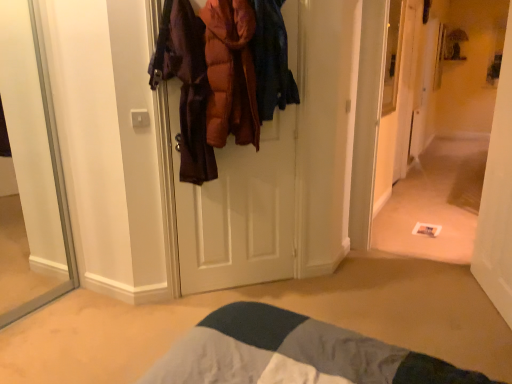
Question: Is white carpet at center at the back of white glossy door at center?

Choices:
 (A) no
 (B) yes

Answer: (A)

Question: Is white carpet at center surrounded by white glossy door at center?

Choices:
 (A) yes
 (B) no

Answer: (B)

Question: From the image's perspective, does white glossy door at center appear lower than white carpet at center?

Choices:
 (A) no
 (B) yes

Answer: (B)

Question: Does white glossy door at center have a greater height compared to white carpet at center?

Choices:
 (A) yes
 (B) no

Answer: (B)

Question: Is white glossy door at center to the right of white carpet at center from the viewer's perspective?

Choices:
 (A) yes
 (B) no

Answer: (A)

Question: Considering the relative sizes of white glossy door at center and white carpet at center in the image provided, is white glossy door at center wider than white carpet at center?

Choices:
 (A) no
 (B) yes

Answer: (B)

Question: Is orange puffy jacket at center looking in the opposite direction of white carpet at center?

Choices:
 (A) no
 (B) yes

Answer: (A)

Question: Can you confirm if orange puffy jacket at center is thinner than white carpet at center?

Choices:
 (A) no
 (B) yes

Answer: (A)

Question: From a real-world perspective, is orange puffy jacket at center beneath white carpet at center?

Choices:
 (A) no
 (B) yes

Answer: (A)

Question: Is orange puffy jacket at center at the left side of white carpet at center?

Choices:
 (A) no
 (B) yes

Answer: (B)

Question: From the image's perspective, does orange puffy jacket at center appear higher than white carpet at center?

Choices:
 (A) no
 (B) yes

Answer: (B)

Question: From the image's perspective, is orange puffy jacket at center beneath white carpet at center?

Choices:
 (A) yes
 (B) no

Answer: (B)

Question: From the image's perspective, is white carpet at center above white glossy door at center?

Choices:
 (A) yes
 (B) no

Answer: (A)